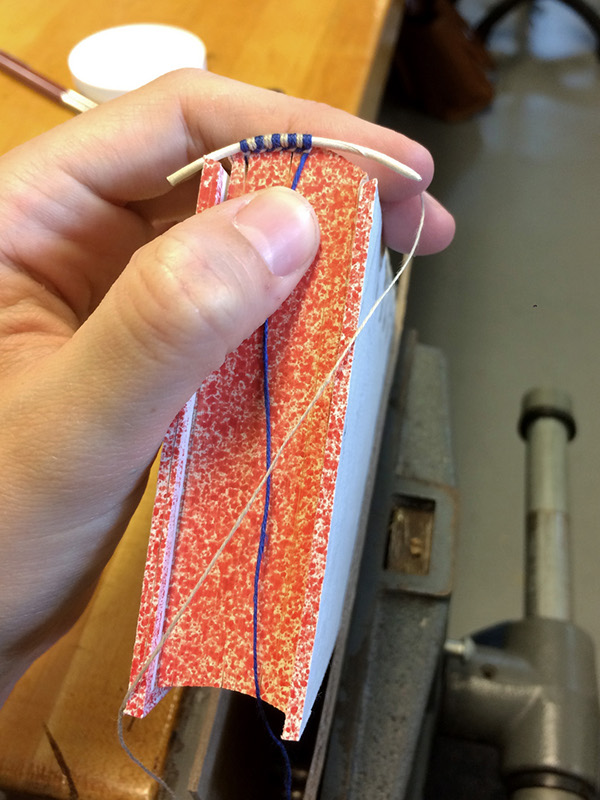
At what (x,y) coordinates should I click in order to perform the action: click on floor. Please return your answer as a coordinate pair (x, y). Looking at the image, I should click on (504, 214).